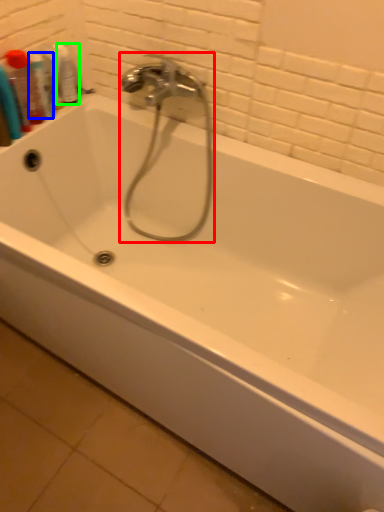
Question: Which is farther away from faucet (highlighted by a red box)? mouthwash (highlighted by a blue box) or mouthwash (highlighted by a green box)?

Choices:
 (A) mouthwash
 (B) mouthwash

Answer: (A)